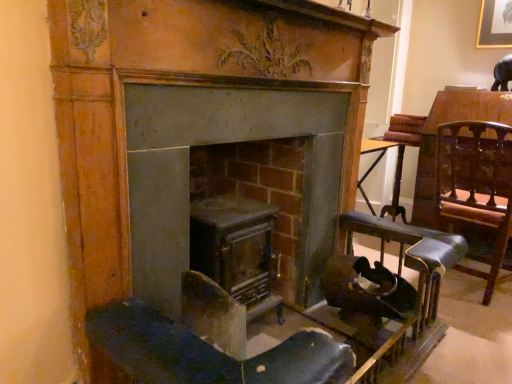
At what (x,y) coordinates should I click in order to perform the action: click on free point above matte gray fireplace at center, the 1th fireplace when ordered from right to left (from a real-world perspective). Please return your answer as a coordinate pair (x, y). Looking at the image, I should click on (266, 21).